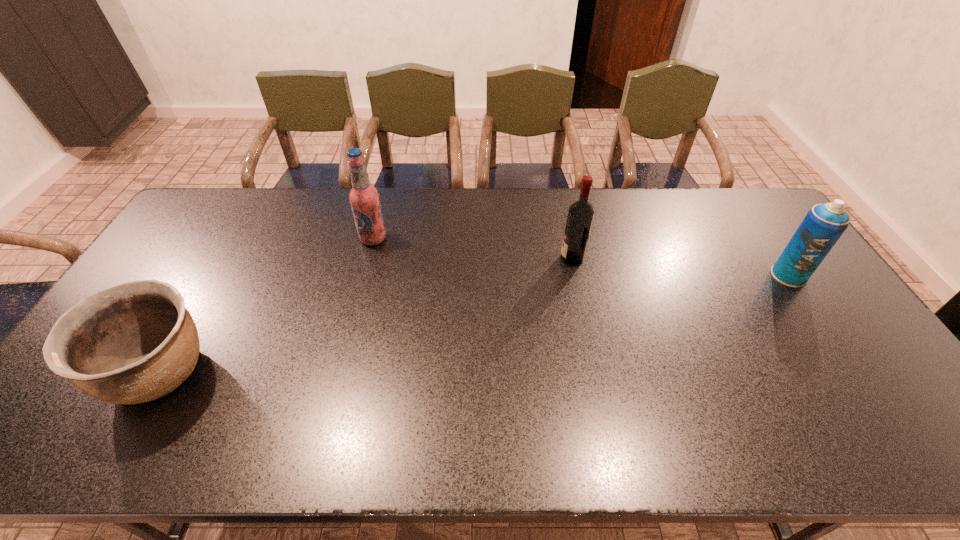
In order to click on vacant space located 0.160m on the front and back of the nearer alcohol in this screenshot , I will do `click(510, 259)`.

What are the coordinates of `free region located on the back of the rightmost object` in the screenshot? It's located at (735, 197).

Where is `vacant space positioned 0.230m on the right of the pottery`? This screenshot has width=960, height=540. vacant space positioned 0.230m on the right of the pottery is located at coordinates (307, 373).

In order to click on object at the far edge in this screenshot , I will do `click(364, 198)`.

Identify the location of object at the near edge. (135, 342).

The height and width of the screenshot is (540, 960). I want to click on object situated at the left edge, so click(x=135, y=342).

Where is `object at the right edge`? object at the right edge is located at coordinates (823, 225).

What are the coordinates of `object positioned at the near left corner` in the screenshot? It's located at (135, 342).

Locate an element on the screen. free region at the far edge of the desktop is located at coordinates (420, 207).

In order to click on vacant space at the near edge of the desktop in this screenshot , I will do `click(368, 446)`.